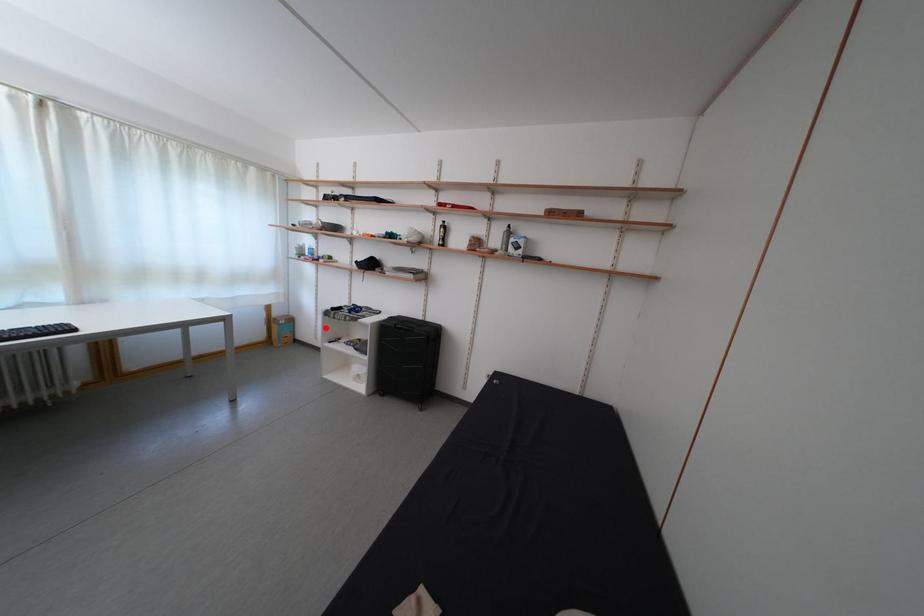
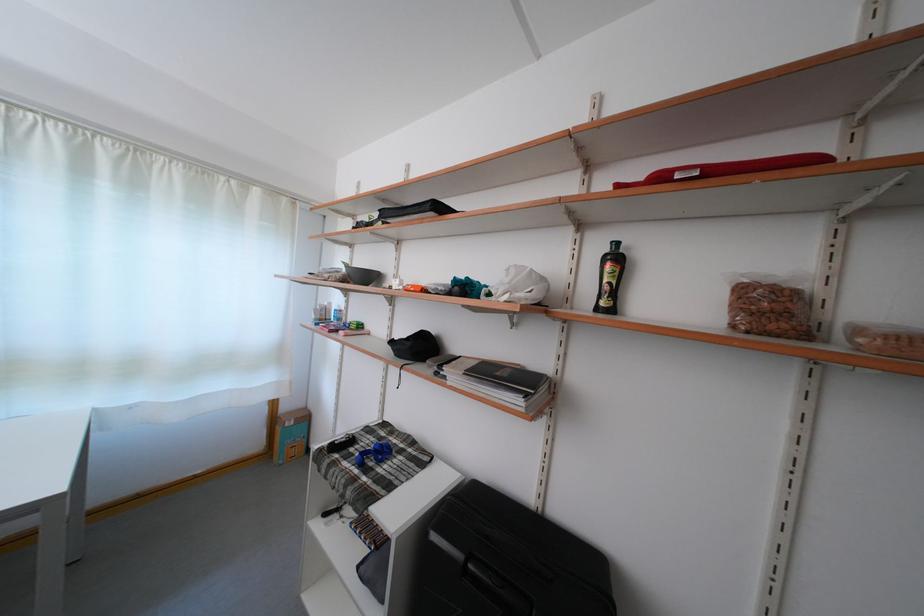
Locate, in the second image, the point that corresponds to the highlighted location in the first image.

(344, 436)